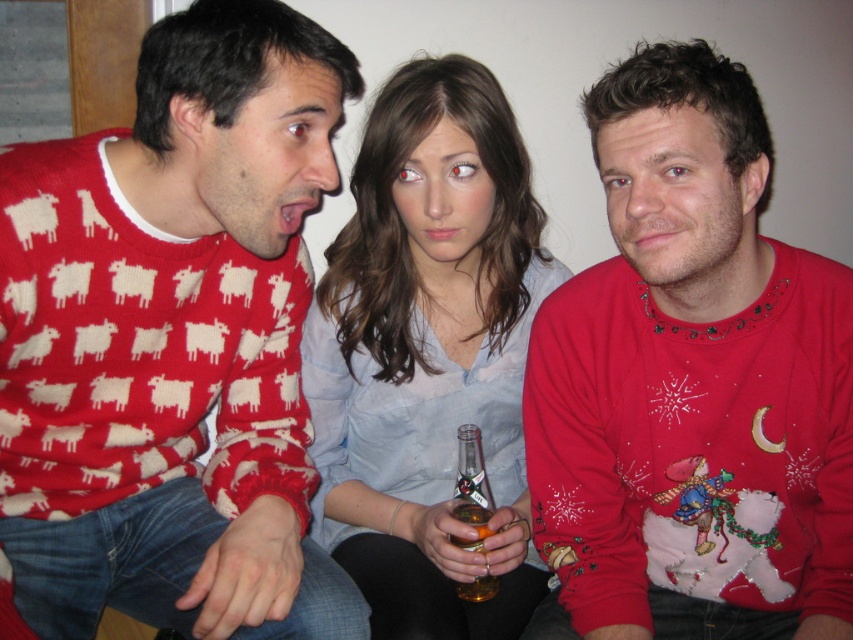
Question: Considering the real-world distances, which object is closest to the matte red sweater at left?

Choices:
 (A) shiny red sweater at center
 (B) translucent glass bottle at center

Answer: (B)

Question: Which point is closer to the camera?

Choices:
 (A) matte red sweater at left
 (B) shiny red sweater at center
 (C) light blue fabric shirt at center

Answer: (A)

Question: Does shiny red sweater at center appear over light blue fabric shirt at center?

Choices:
 (A) yes
 (B) no

Answer: (B)

Question: Which of these objects is positioned closest to the translucent glass bottle at center?

Choices:
 (A) matte red sweater at left
 (B) light blue fabric shirt at center
 (C) shiny red sweater at center

Answer: (B)

Question: Can you confirm if light blue fabric shirt at center is thinner than translucent glass bottle at center?

Choices:
 (A) no
 (B) yes

Answer: (A)

Question: Is shiny red sweater at center above light blue fabric shirt at center?

Choices:
 (A) no
 (B) yes

Answer: (A)